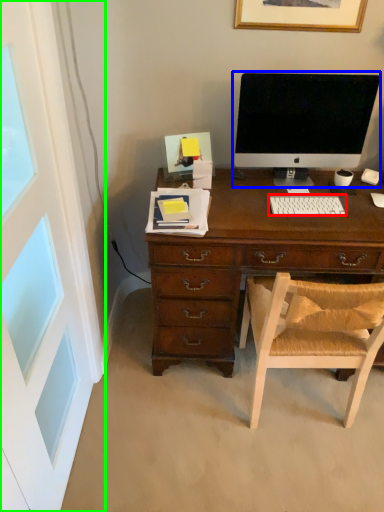
Question: Considering the real-world distances, which object is farthest from computer keyboard (highlighted by a red box)? computer monitor (highlighted by a blue box) or screen door (highlighted by a green box)?

Choices:
 (A) computer monitor
 (B) screen door

Answer: (B)